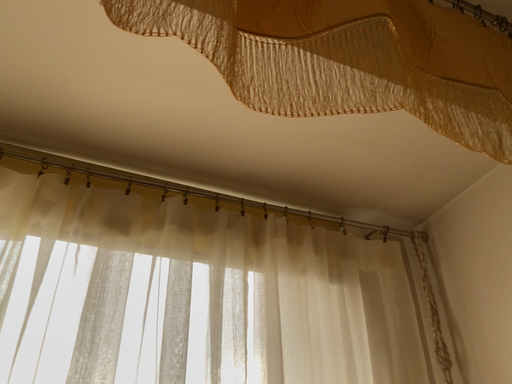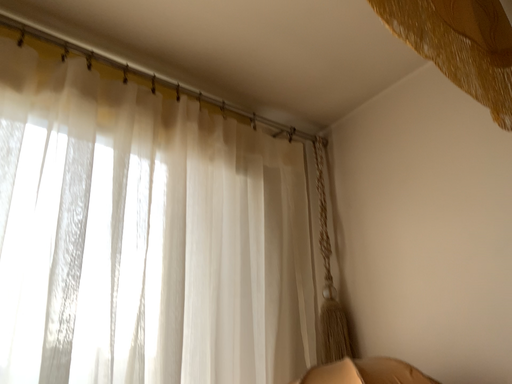
Question: How did the camera likely rotate when shooting the video?

Choices:
 (A) rotated left
 (B) rotated right

Answer: (B)